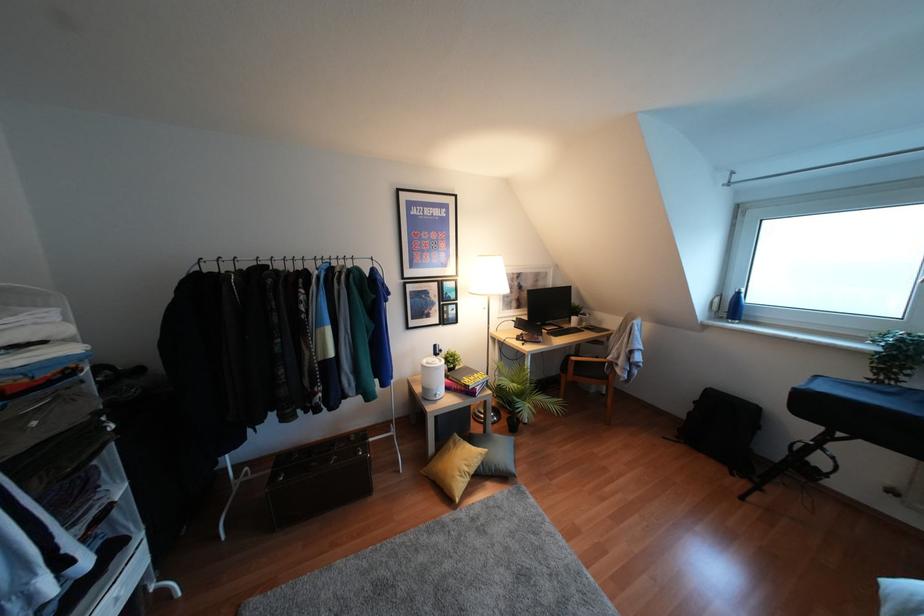
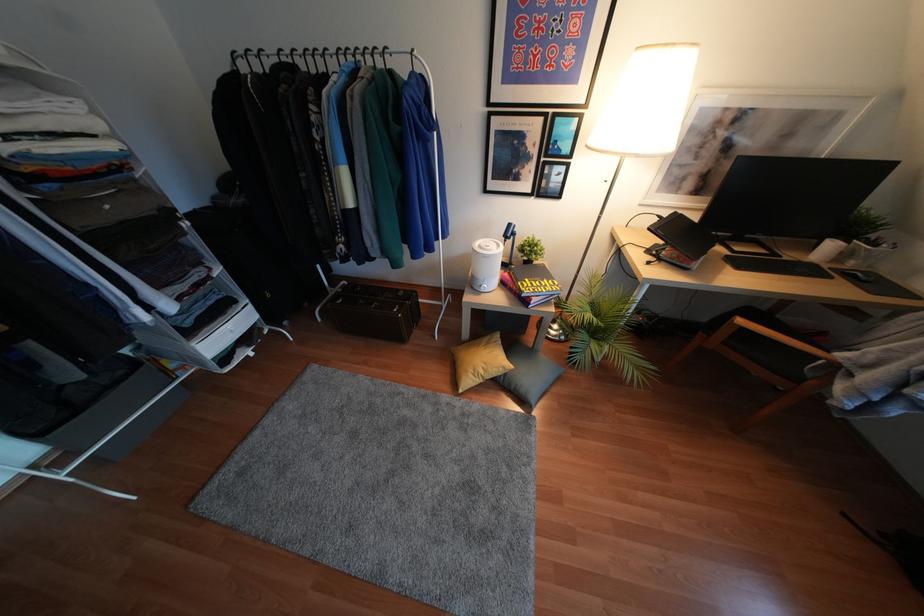
Where in the second image is the point corresponding to the point at 436,397 from the first image?

(481, 290)